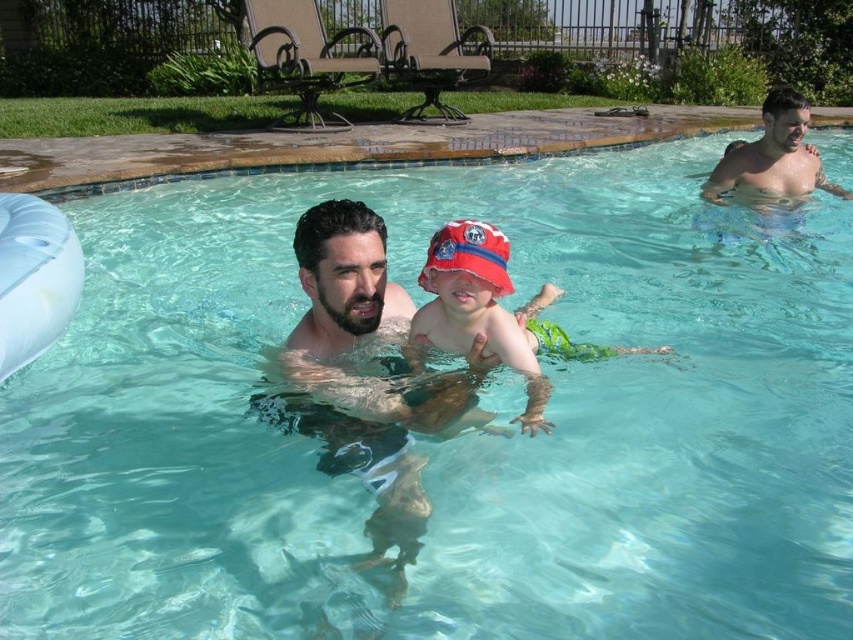
Which is more to the left, red fabric bucket hat at center or smooth skin man at upper right?

red fabric bucket hat at center is more to the left.

Is point (424, 307) closer to camera compared to point (781, 106)?

Yes, point (424, 307) is closer to viewer.

Where is `red fabric bucket hat at center`? red fabric bucket hat at center is located at coordinates (476, 307).